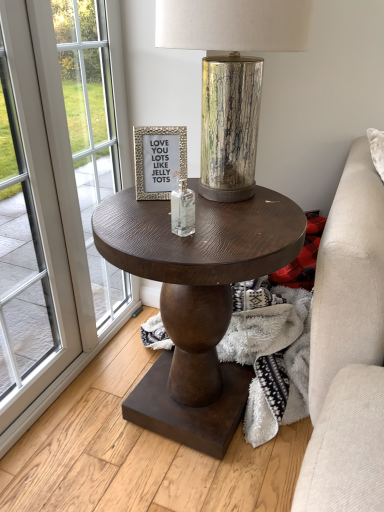
Question: From the image's perspective, is dark wood round table at center beneath clear glass bottle at center?

Choices:
 (A) yes
 (B) no

Answer: (A)

Question: Is the surface of dark wood round table at center in direct contact with clear glass bottle at center?

Choices:
 (A) no
 (B) yes

Answer: (A)

Question: Considering the relative positions of dark wood round table at center and clear glass bottle at center in the image provided, is dark wood round table at center to the right of clear glass bottle at center from the viewer's perspective?

Choices:
 (A) yes
 (B) no

Answer: (A)

Question: Would you say dark wood round table at center is outside clear glass bottle at center?

Choices:
 (A) yes
 (B) no

Answer: (A)

Question: Considering the relative positions of dark wood round table at center and clear glass bottle at center in the image provided, is dark wood round table at center to the left of clear glass bottle at center from the viewer's perspective?

Choices:
 (A) no
 (B) yes

Answer: (A)

Question: Is clear glass bottle at center bigger or smaller than dark wood round table at center?

Choices:
 (A) small
 (B) big

Answer: (A)

Question: Is clear glass bottle at center inside the boundaries of dark wood round table at center, or outside?

Choices:
 (A) outside
 (B) inside

Answer: (A)

Question: From the image's perspective, is clear glass bottle at center positioned above or below dark wood round table at center?

Choices:
 (A) below
 (B) above

Answer: (B)

Question: In terms of height, does clear glass bottle at center look taller or shorter compared to dark wood round table at center?

Choices:
 (A) tall
 (B) short

Answer: (B)

Question: Is white glass window at left taller or shorter than silver textured frame at center?

Choices:
 (A) tall
 (B) short

Answer: (A)

Question: From the image's perspective, relative to silver textured frame at center, is white glass window at left above or below?

Choices:
 (A) below
 (B) above

Answer: (A)

Question: In terms of size, does white glass window at left appear bigger or smaller than silver textured frame at center?

Choices:
 (A) small
 (B) big

Answer: (B)

Question: Considering the relative positions of white glass window at left and silver textured frame at center in the image provided, is white glass window at left to the left or to the right of silver textured frame at center?

Choices:
 (A) left
 (B) right

Answer: (A)

Question: Is dark wood round table at center in front of or behind silver textured frame at center in the image?

Choices:
 (A) front
 (B) behind

Answer: (A)

Question: Is dark wood round table at center to the left or to the right of silver textured frame at center in the image?

Choices:
 (A) left
 (B) right

Answer: (B)